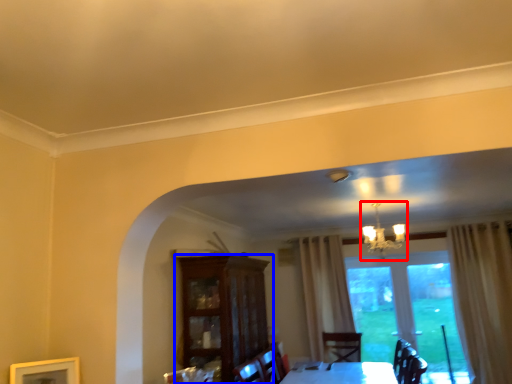
Question: Which of the following is the farthest to the observer, light fixture (highlighted by a red box) or cabinetry (highlighted by a blue box)?

Choices:
 (A) light fixture
 (B) cabinetry

Answer: (A)